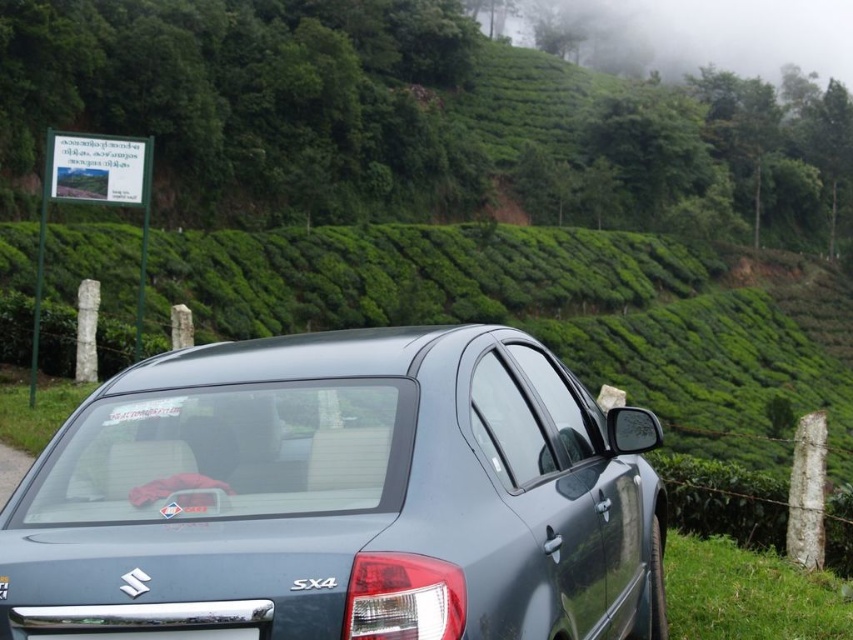
Is foggy greenery at upper center thinner than black plastic license plate at lower center?

Incorrect, foggy greenery at upper center's width is not less than black plastic license plate at lower center's.

Who is higher up, foggy greenery at upper center or black plastic license plate at lower center?

foggy greenery at upper center

Who is more distant from viewer, [670,17] or [148,628]?

The point [670,17] is more distant.

Find the location of `foggy greenery at upper center`. foggy greenery at upper center is located at coordinates pos(704,35).

Measure the distance between satin metallic car at center and camera.

They are 2.43 meters apart.

Does satin metallic car at center appear on the left side of foggy greenery at upper center?

Indeed, satin metallic car at center is positioned on the left side of foggy greenery at upper center.

Between point (560, 362) and point (538, 1), which one is positioned behind?

The point (538, 1) is more distant.

Identify the location of satin metallic car at center. The width and height of the screenshot is (853, 640). (343, 496).

Who is more forward, (171, 353) or (163, 632)?

Positioned in front is point (163, 632).

Can you confirm if satin metallic car at center is positioned above black plastic license plate at lower center?

Indeed, satin metallic car at center is positioned over black plastic license plate at lower center.

Where is `satin metallic car at center`? The width and height of the screenshot is (853, 640). satin metallic car at center is located at coordinates 343,496.